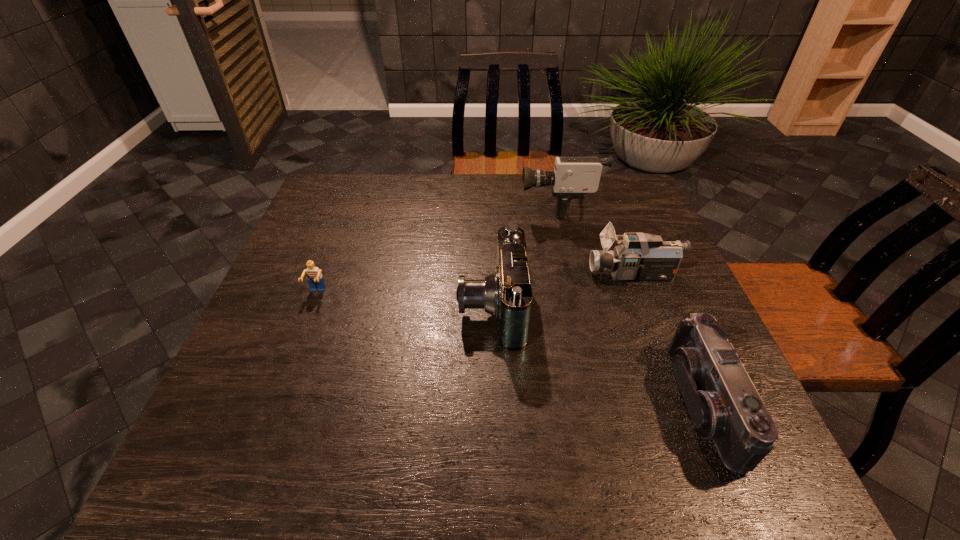
At what (x,y) coordinates should I click in order to perform the action: click on the tallest object. Please return your answer as a coordinate pair (x, y). The image size is (960, 540). Looking at the image, I should click on (573, 177).

At what (x,y) coordinates should I click in order to perform the action: click on the tallest camcorder. Please return your answer as a coordinate pair (x, y). This screenshot has width=960, height=540. Looking at the image, I should click on (573, 177).

What are the coordinates of `the leftmost camcorder` in the screenshot? It's located at (506, 294).

This screenshot has height=540, width=960. I want to click on Lego, so click(x=314, y=276).

Where is `the leftmost object`? The height and width of the screenshot is (540, 960). the leftmost object is located at coordinates (314, 276).

Image resolution: width=960 pixels, height=540 pixels. Identify the location of free location located 0.350m on the recording direction of the tallest camcorder. (404, 206).

Find the location of a particular element. The height and width of the screenshot is (540, 960). vacant area located on the recording direction of the tallest camcorder is located at coordinates (483, 206).

You are a GUI agent. You are given a task and a screenshot of the screen. Output one action in this format:
    pyautogui.click(x=<x>, y=<y>)
    Task: Click on the vacant space located 0.060m on the recording direction of the tallest camcorder
    This screenshot has width=960, height=540.
    Given the screenshot: What is the action you would take?
    pyautogui.click(x=499, y=206)

Where is `vacant space situated 0.120m on the front-facing side of the fourth object from right to left`? The image size is (960, 540). vacant space situated 0.120m on the front-facing side of the fourth object from right to left is located at coordinates (407, 306).

Image resolution: width=960 pixels, height=540 pixels. What are the coordinates of `free space located 0.330m on the front-facing side of the fourth object from right to left` in the screenshot? It's located at (317, 306).